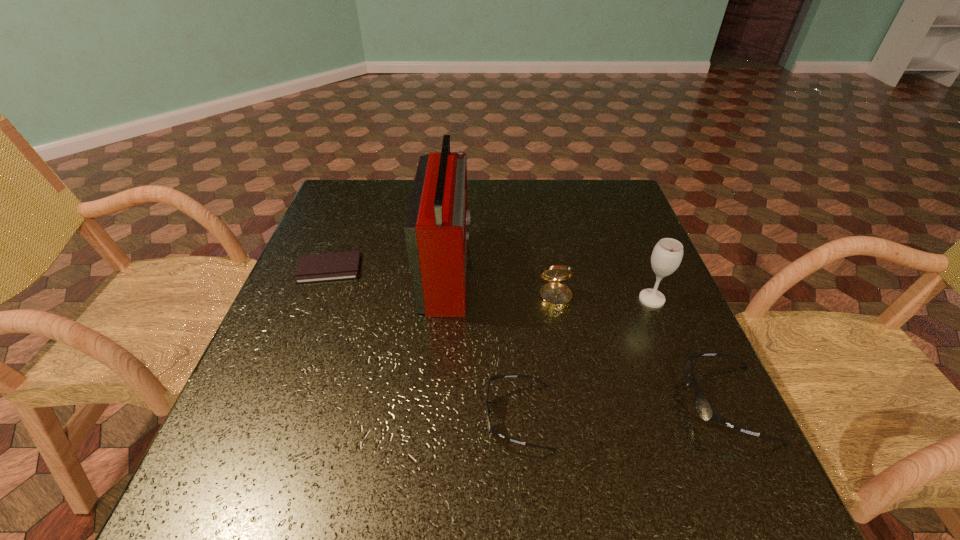
The image size is (960, 540). I want to click on object that is the fourth closest one to the compass, so click(704, 409).

Locate which object ranks fourth in proximity to the checkbook. Please provide its 2D coordinates. Your answer should be formatted as a tuple, i.e. [(x, y)], where the tuple contains the x and y coordinates of a point satisfying the conditions above.

[(667, 254)]

Identify the location of free spot that satisfies the following two spatial constraints: 1. on the front-facing side of the second tallest object; 2. on the right side of the tallest object. (444, 299).